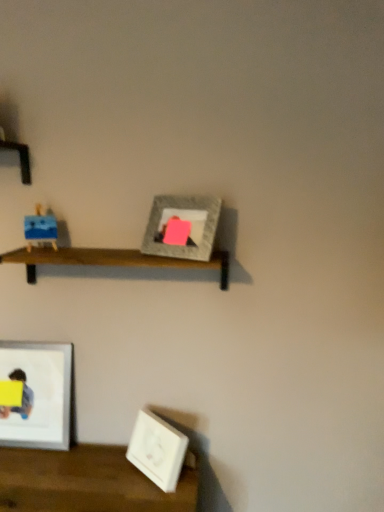
Question: Does matte gray picture frame at center, the first picture frame in the top-to-bottom sequence, touch white matte picture frame at lower right, which is counted as the second picture frame, starting from the left?

Choices:
 (A) no
 (B) yes

Answer: (A)

Question: From the image's perspective, is matte gray picture frame at center, which is the 3th picture frame from bottom to top, on white matte picture frame at lower right, placed as the 2th picture frame when sorted from right to left?

Choices:
 (A) no
 (B) yes

Answer: (B)

Question: Can you confirm if matte gray picture frame at center, which is the 3th picture frame from bottom to top, is smaller than white matte picture frame at lower right, placed as the 2th picture frame when sorted from right to left?

Choices:
 (A) yes
 (B) no

Answer: (A)

Question: From a real-world perspective, is matte gray picture frame at center, which is the 3th picture frame from bottom to top, beneath white matte picture frame at lower right, positioned as the 3th picture frame in top-to-bottom order?

Choices:
 (A) no
 (B) yes

Answer: (A)

Question: Is matte gray picture frame at center, which is counted as the third picture frame, starting from the left, positioned behind white matte picture frame at lower right, positioned as the 1th picture frame in bottom-to-top order?

Choices:
 (A) yes
 (B) no

Answer: (B)

Question: Is matte gray picture frame at center, which is counted as the 1th picture frame, starting from the right, at the right side of white matte picture frame at lower right, which is counted as the second picture frame, starting from the left?

Choices:
 (A) yes
 (B) no

Answer: (A)

Question: Does wooden shelf at center have a larger size compared to white glossy picture frame at lower left, arranged as the second picture frame when ordered from the bottom?

Choices:
 (A) no
 (B) yes

Answer: (B)

Question: Is wooden shelf at center at the right side of white glossy picture frame at lower left, the first picture frame when ordered from left to right?

Choices:
 (A) yes
 (B) no

Answer: (A)

Question: Is wooden shelf at center not near white glossy picture frame at lower left, arranged as the second picture frame when ordered from the bottom?

Choices:
 (A) no
 (B) yes

Answer: (A)

Question: Is wooden shelf at center shorter than white glossy picture frame at lower left, the first picture frame when ordered from left to right?

Choices:
 (A) no
 (B) yes

Answer: (B)

Question: Is wooden shelf at center behind white glossy picture frame at lower left, the first picture frame when ordered from left to right?

Choices:
 (A) yes
 (B) no

Answer: (B)

Question: Would you say white glossy picture frame at lower left, the first picture frame when ordered from left to right, is part of wooden shelf at center's contents?

Choices:
 (A) no
 (B) yes

Answer: (A)

Question: Is wooden shelf at center behind yellow matte paper at lower left?

Choices:
 (A) no
 (B) yes

Answer: (A)